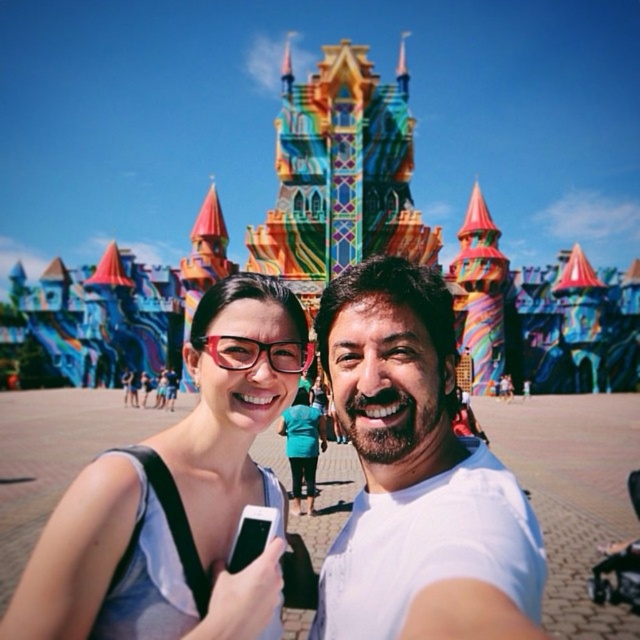
You are a photographer trying to capture the multicolored painted castle at center and the matte black glasses at center in a single frame. Based on their positions, which object should you adjust your camera angle to focus on first to ensure both are in the frame?

The multicolored painted castle at center is positioned on the right side of matte black glasses at center. To ensure both are in the frame, you should first focus on the matte black glasses at center, then adjust your camera angle to include the multicolored painted castle at center on its right side.

You are a photographer trying to capture a clear shot of the matte white tank top at center and the matte black glasses at center. Which object should you focus on to ensure it appears sharp in the photo?

The matte white tank top at center has a larger size compared to the matte black glasses at center, so focusing on the larger matte white tank top at center will ensure it appears sharp in the photo.

You are standing in a theme park and want to take a selfie with the multicolored painted castle at center in the background. Given that the castle is 106.11 meters away, can you fit the entire castle into your smartphone camera frame without moving closer?

The multicolored painted castle at center is 106.11 meters away from the viewer. Depending on the smartphone camera lens and zoom capabilities, it may be challenging to capture the entire castle in one frame without moving closer, as the distance is quite significant.